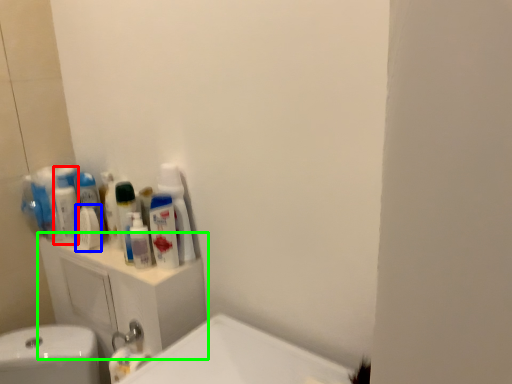
Question: Based on their relative distances, which object is nearer to mouthwash (highlighted by a red box)? Choose from mouthwash (highlighted by a blue box) and bathroom cabinet (highlighted by a green box).

Choices:
 (A) mouthwash
 (B) bathroom cabinet

Answer: (A)